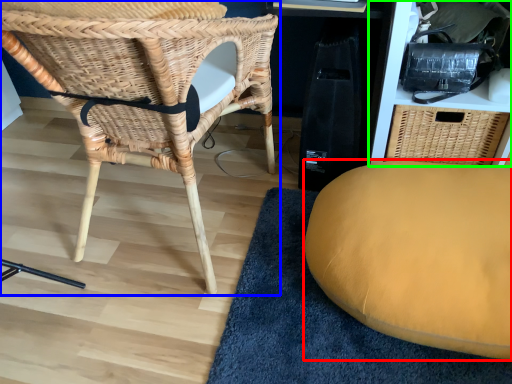
Question: Based on their relative distances, which object is farther from furniture (highlighted by a red box)? Choose from chair (highlighted by a blue box) and shelf (highlighted by a green box).

Choices:
 (A) chair
 (B) shelf

Answer: (A)